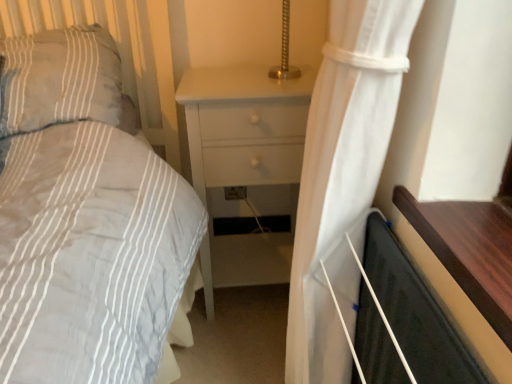
Question: Is white sheer curtain at right located outside white matte nightstand at center?

Choices:
 (A) no
 (B) yes

Answer: (B)

Question: Is white sheer curtain at right touching white matte nightstand at center?

Choices:
 (A) no
 (B) yes

Answer: (A)

Question: Is white sheer curtain at right looking in the opposite direction of white matte nightstand at center?

Choices:
 (A) no
 (B) yes

Answer: (A)

Question: Is white sheer curtain at right far away from white matte nightstand at center?

Choices:
 (A) yes
 (B) no

Answer: (B)

Question: Is white sheer curtain at right oriented towards white matte nightstand at center?

Choices:
 (A) yes
 (B) no

Answer: (B)

Question: In terms of size, does gray striped pillow at upper left appear bigger or smaller than white matte nightstand at center?

Choices:
 (A) big
 (B) small

Answer: (B)

Question: Considering the positions of gray striped pillow at upper left and white matte nightstand at center in the image, is gray striped pillow at upper left wider or thinner than white matte nightstand at center?

Choices:
 (A) thin
 (B) wide

Answer: (A)

Question: From the image's perspective, is gray striped pillow at upper left above or below white matte nightstand at center?

Choices:
 (A) above
 (B) below

Answer: (A)

Question: From a real-world perspective, is gray striped pillow at upper left positioned above or below white matte nightstand at center?

Choices:
 (A) below
 (B) above

Answer: (B)

Question: Considering the positions of point (53, 72) and point (345, 87), is point (53, 72) closer or farther from the camera than point (345, 87)?

Choices:
 (A) closer
 (B) farther

Answer: (B)

Question: From the image's perspective, is gray striped pillow at upper left above or below white sheer curtain at right?

Choices:
 (A) below
 (B) above

Answer: (B)

Question: Considering their positions, is gray striped pillow at upper left located in front of or behind white sheer curtain at right?

Choices:
 (A) front
 (B) behind

Answer: (B)

Question: From a real-world perspective, is gray striped pillow at upper left physically located above or below white sheer curtain at right?

Choices:
 (A) above
 (B) below

Answer: (A)

Question: In terms of height, does white sheer curtain at right look taller or shorter compared to black matte screen door at lower right?

Choices:
 (A) tall
 (B) short

Answer: (A)

Question: Is white sheer curtain at right in front of or behind black matte screen door at lower right in the image?

Choices:
 (A) behind
 (B) front

Answer: (B)